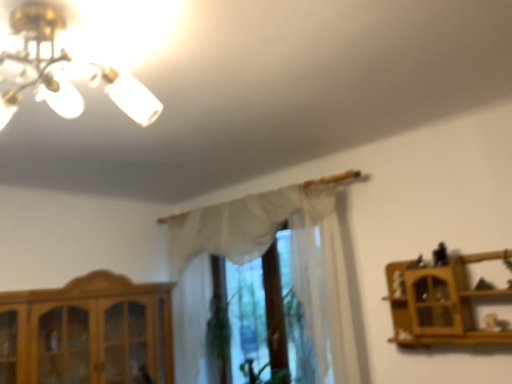
Question: From a real-world perspective, is wooden cabinet at lower left located higher than white sheer curtain at center?

Choices:
 (A) yes
 (B) no

Answer: (B)

Question: Considering the relative sizes of wooden cabinet at lower left and white sheer curtain at center in the image provided, is wooden cabinet at lower left wider than white sheer curtain at center?

Choices:
 (A) yes
 (B) no

Answer: (A)

Question: Is wooden cabinet at lower left touching white sheer curtain at center?

Choices:
 (A) yes
 (B) no

Answer: (B)

Question: Is wooden cabinet at lower left aimed at white sheer curtain at center?

Choices:
 (A) no
 (B) yes

Answer: (B)

Question: Is wooden cabinet at lower left closer to camera compared to white sheer curtain at center?

Choices:
 (A) no
 (B) yes

Answer: (B)

Question: Relative to wooden shelf at right, is wooden cabinet at lower left in front or behind?

Choices:
 (A) front
 (B) behind

Answer: (B)

Question: Is point click(x=143, y=292) positioned closer to the camera than point click(x=423, y=283)?

Choices:
 (A) closer
 (B) farther

Answer: (B)

Question: From the image's perspective, relative to wooden shelf at right, is wooden cabinet at lower left above or below?

Choices:
 (A) above
 (B) below

Answer: (B)

Question: In terms of width, does wooden cabinet at lower left look wider or thinner when compared to wooden shelf at right?

Choices:
 (A) wide
 (B) thin

Answer: (A)

Question: Considering the positions of wooden shelf at right and wooden cabinet at lower left in the image, is wooden shelf at right taller or shorter than wooden cabinet at lower left?

Choices:
 (A) short
 (B) tall

Answer: (A)

Question: Is wooden shelf at right to the left or to the right of wooden cabinet at lower left in the image?

Choices:
 (A) left
 (B) right

Answer: (B)

Question: Relative to wooden cabinet at lower left, is wooden shelf at right in front or behind?

Choices:
 (A) behind
 (B) front

Answer: (B)

Question: Is point (419, 268) closer or farther from the camera than point (34, 299)?

Choices:
 (A) closer
 (B) farther

Answer: (A)

Question: Based on their positions, is wooden shelf at right located to the left or right of white sheer curtain at center?

Choices:
 (A) left
 (B) right

Answer: (B)

Question: Is wooden shelf at right wider or thinner than white sheer curtain at center?

Choices:
 (A) wide
 (B) thin

Answer: (A)